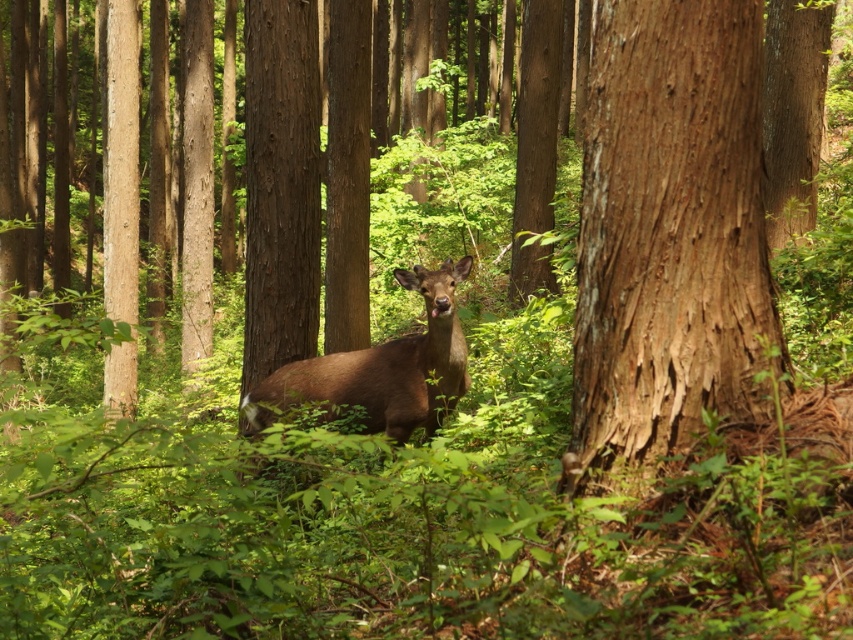
Question: Which point is closer to the camera?

Choices:
 (A) (360, 400)
 (B) (737, 403)

Answer: (B)

Question: Which object is closer to the camera taking this photo?

Choices:
 (A) brown matte/deer at center
 (B) brown textured bark at center

Answer: (B)

Question: Observing the image, what is the correct spatial positioning of brown textured bark at center in reference to brown matte/deer at center?

Choices:
 (A) below
 (B) above

Answer: (B)

Question: Is brown textured bark at center wider than brown matte/deer at center?

Choices:
 (A) yes
 (B) no

Answer: (B)

Question: Which point is closer to the camera taking this photo?

Choices:
 (A) (328, 397)
 (B) (671, 448)

Answer: (B)

Question: Is brown textured bark at center above brown matte/deer at center?

Choices:
 (A) yes
 (B) no

Answer: (A)